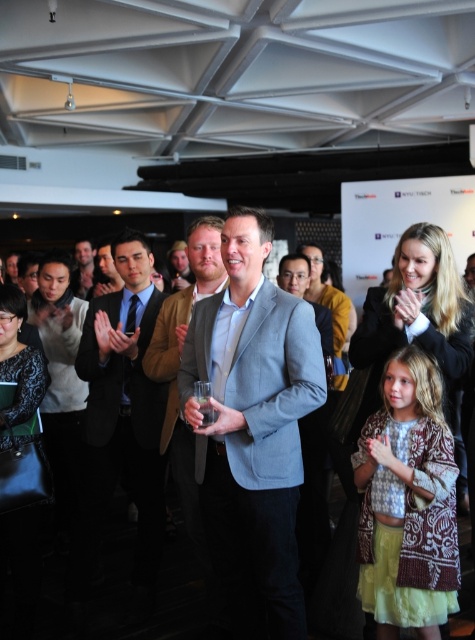
Between light gray suit at center and matte black suit at center, which one has less height?

matte black suit at center is shorter.

Is light gray suit at center positioned at the back of matte black suit at center?

No, light gray suit at center is closer to the viewer.

Between point (231, 483) and point (74, 250), which one is positioned behind?

The point (74, 250) is more distant.

You are a GUI agent. You are given a task and a screenshot of the screen. Output one action in this format:
    pyautogui.click(x=<x>, y=<y>)
    Task: Click on the light gray suit at center
    The height and width of the screenshot is (640, 475).
    Given the screenshot: What is the action you would take?
    pyautogui.click(x=253, y=429)

Does black satin business suit at center have a larger size compared to light brown leather jacket at center?

No, black satin business suit at center is not bigger than light brown leather jacket at center.

Is black satin business suit at center to the left of light brown leather jacket at center from the viewer's perspective?

Yes, black satin business suit at center is to the left of light brown leather jacket at center.

Find the location of a particular element. Image resolution: width=475 pixels, height=640 pixels. black satin business suit at center is located at coordinates (121, 378).

This screenshot has height=640, width=475. What are the coordinates of `black satin business suit at center` in the screenshot? It's located at (121, 378).

Does light gray suit at center appear on the left side of light brown leather jacket at center?

Incorrect, light gray suit at center is not on the left side of light brown leather jacket at center.

Can you confirm if light gray suit at center is shorter than light brown leather jacket at center?

In fact, light gray suit at center may be taller than light brown leather jacket at center.

Does point (260, 604) come behind point (211, 269)?

No, it is in front of (211, 269).

Identify the location of light gray suit at center. This screenshot has width=475, height=640. (253, 429).